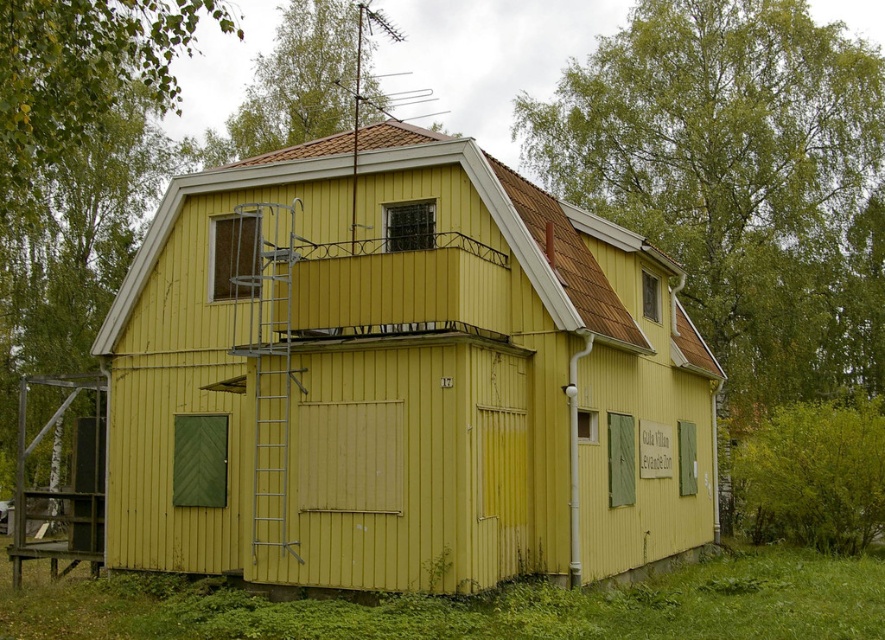
Which is above, yellow wood cabin at center or silver metallic ladder at center?

silver metallic ladder at center is higher up.

Who is taller, yellow wood cabin at center or silver metallic ladder at center?

yellow wood cabin at center is taller.

The width and height of the screenshot is (885, 640). In order to click on yellow wood cabin at center in this screenshot , I will do (399, 378).

Does silver metallic ladder at center have a lesser height compared to wooden scaffolding at left?

Correct, silver metallic ladder at center is not as tall as wooden scaffolding at left.

Is silver metallic ladder at center to the left of wooden scaffolding at left from the viewer's perspective?

Incorrect, silver metallic ladder at center is not on the left side of wooden scaffolding at left.

Find the location of a particular element. silver metallic ladder at center is located at coordinates (267, 356).

Does yellow wood cabin at center have a larger size compared to wooden scaffolding at left?

No.

Does yellow wood cabin at center appear on the left side of wooden scaffolding at left?

Incorrect, yellow wood cabin at center is not on the left side of wooden scaffolding at left.

Which is behind, point (599, 440) or point (17, 436)?

Point (17, 436)

You are a GUI agent. You are given a task and a screenshot of the screen. Output one action in this format:
    pyautogui.click(x=<x>, y=<y>)
    Task: Click on the yellow wood cabin at center
    Image resolution: width=885 pixels, height=640 pixels.
    Given the screenshot: What is the action you would take?
    pyautogui.click(x=399, y=378)